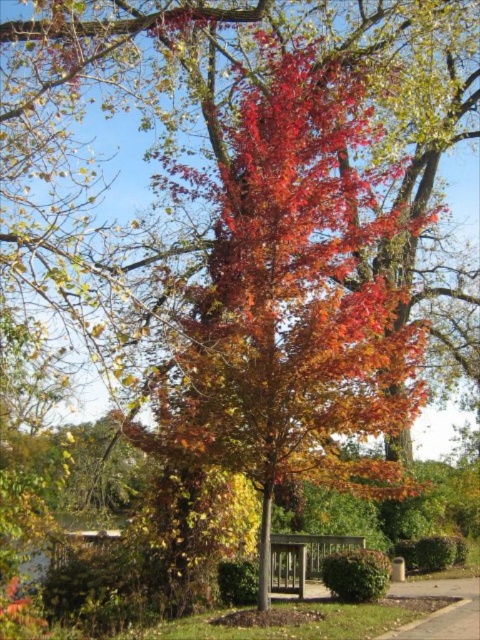
Based on the photo, you are standing in the park and see the shiny red leaves at center and the wooden park bench at center. Which object is nearer to you?

The shiny red leaves at center are closer to the viewer than the wooden park bench at center.

You are standing at the center of the image and want to pick up the shiny red leaves at center. In which direction should you move relative to your current position?

The shiny red leaves at center are already at your current position, so you don not need to move in any direction.

You are sitting on the wooden park bench at center and want to reach out to touch the shiny red leaves at center. In which direction should you extend your hand to reach them?

The shiny red leaves at center are to the right of the wooden park bench at center, so you should extend your hand to the right to reach them.